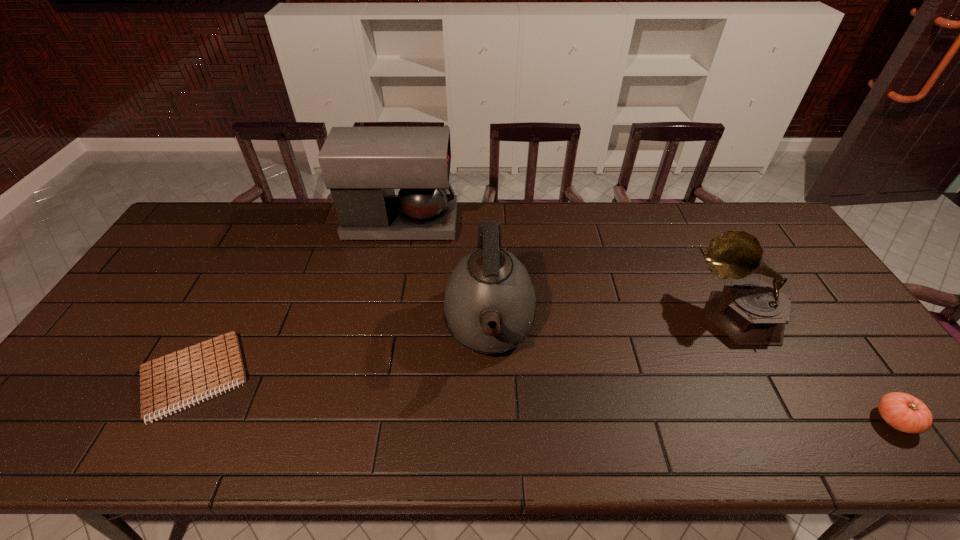
In the image, there is a desktop. Identify the location of vacant space at the far edge. (660, 212).

In the image, there is a desktop. Identify the location of vacant space at the near edge. (126, 442).

This screenshot has height=540, width=960. Identify the location of vacant space at the right edge. (800, 287).

I want to click on vacant space at the near left corner of the desktop, so click(x=95, y=440).

What are the coordinates of `free space between the notebook and the fourth tallest object` in the screenshot? It's located at (544, 399).

You are a GUI agent. You are given a task and a screenshot of the screen. Output one action in this format:
    pyautogui.click(x=<x>, y=<y>)
    Task: Click on the vacant area between the third tallest object and the rightmost object
    This screenshot has height=540, width=960.
    Given the screenshot: What is the action you would take?
    pyautogui.click(x=816, y=366)

At what (x,y) coordinates should I click in order to perform the action: click on vacant area between the shortest object and the kettle. Please return your answer as a coordinate pair (x, y). Looking at the image, I should click on point(342,353).

In order to click on empty location between the farthest object and the tomato in this screenshot , I will do `click(648, 322)`.

Identify the location of free space between the fourth tallest object and the kettle. (692, 374).

I want to click on empty space that is in between the coffee maker and the phonograph record, so click(x=569, y=268).